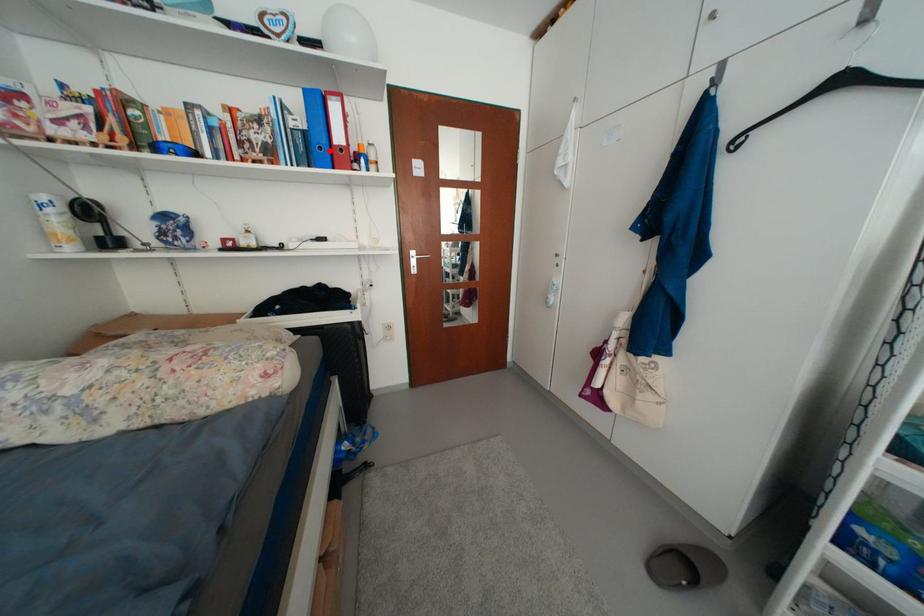
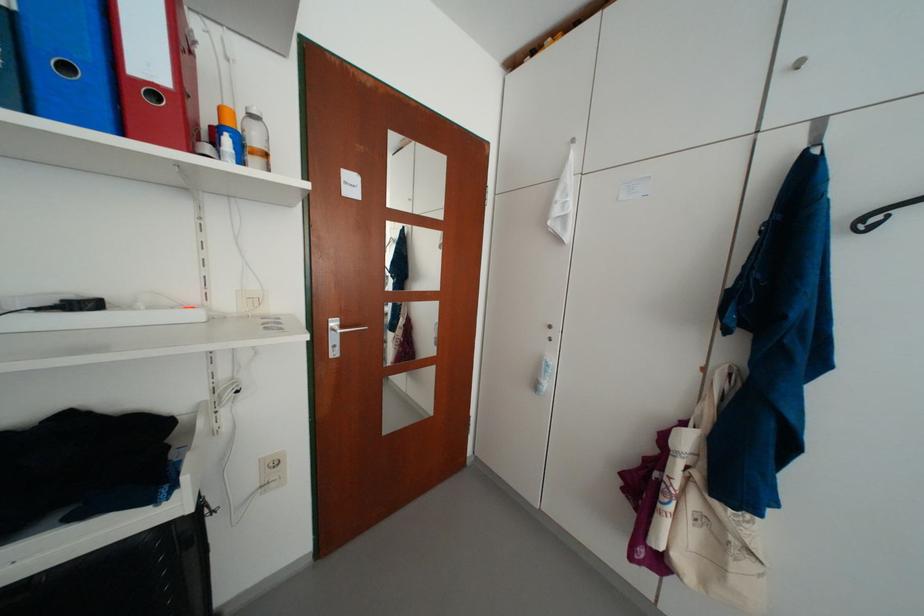
Question: I am providing you with two images of the same scene from different viewpoints. Image1 has a red point marked. In image2, the corresponding 3D location appears at what relative position? Reply with the corresponding letter.

Choices:
 (A) Closer
 (B) Farther

Answer: (B)